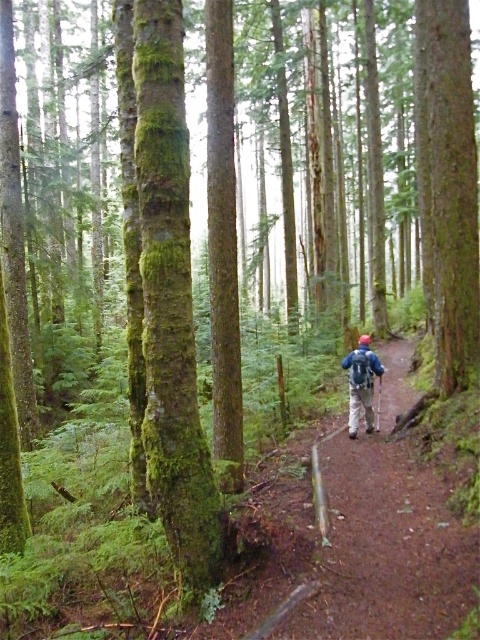
Question: Which object is closer to the camera taking this photo?

Choices:
 (A) blue fabric backpack at center
 (B) blue matte jacket at center

Answer: (B)

Question: Which point is closer to the camera taking this photo?

Choices:
 (A) (361, 397)
 (B) (178, 81)
 (C) (348, 356)

Answer: (B)

Question: Does blue fabric backpack at center appear on the right side of blue matte jacket at center?

Choices:
 (A) no
 (B) yes

Answer: (B)

Question: Does green mossy tree trunk at center lie behind blue fabric backpack at center?

Choices:
 (A) yes
 (B) no

Answer: (B)

Question: Which point is closer to the camera taking this photo?

Choices:
 (A) (372, 376)
 (B) (355, 404)
 (C) (166, 292)

Answer: (C)

Question: Is green mossy tree trunk at center above blue fabric backpack at center?

Choices:
 (A) no
 (B) yes

Answer: (B)